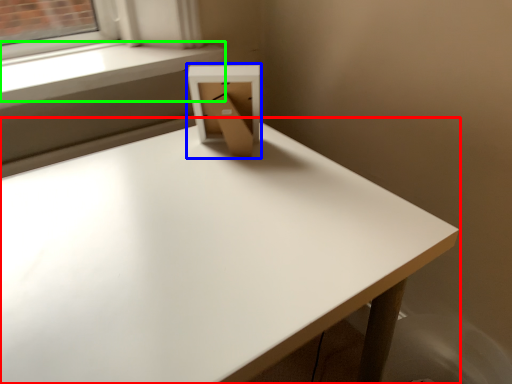
Question: Estimate the real-world distances between objects in this image. Which object is closer to table (highlighted by a red box), cardboard box (highlighted by a blue box) or window sill (highlighted by a green box)?

Choices:
 (A) cardboard box
 (B) window sill

Answer: (A)